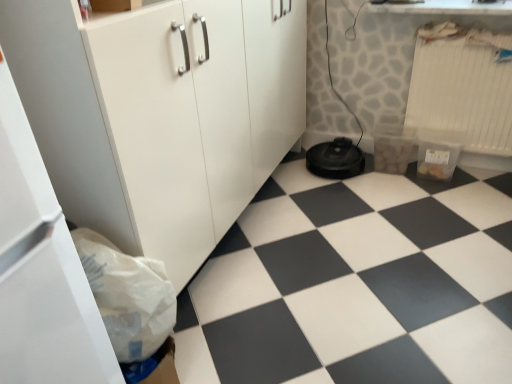
Question: Is white matte cabinet at lower left taller than white plastic radiator at upper right?

Choices:
 (A) no
 (B) yes

Answer: (B)

Question: From a real-world perspective, is white matte cabinet at lower left located beneath white plastic radiator at upper right?

Choices:
 (A) no
 (B) yes

Answer: (A)

Question: Can you see white matte cabinet at lower left touching white plastic radiator at upper right?

Choices:
 (A) no
 (B) yes

Answer: (A)

Question: Is white matte cabinet at lower left at the right side of white plastic radiator at upper right?

Choices:
 (A) no
 (B) yes

Answer: (A)

Question: Does white matte cabinet at lower left have a lesser width compared to white plastic radiator at upper right?

Choices:
 (A) yes
 (B) no

Answer: (B)

Question: From the image's perspective, relative to white plastic radiator at upper right, is white matte cabinet at lower left above or below?

Choices:
 (A) above
 (B) below

Answer: (B)

Question: Is point (125, 119) closer or farther from the camera than point (487, 99)?

Choices:
 (A) closer
 (B) farther

Answer: (A)

Question: In terms of size, does white matte cabinet at lower left appear bigger or smaller than white plastic radiator at upper right?

Choices:
 (A) small
 (B) big

Answer: (B)

Question: From a real-world perspective, is white matte cabinet at lower left positioned above or below white plastic radiator at upper right?

Choices:
 (A) above
 (B) below

Answer: (A)

Question: Looking at their shapes, would you say black plastic robot vacuum cleaner at lower center is wider or thinner than black rubber vacuum cleaner at lower center?

Choices:
 (A) thin
 (B) wide

Answer: (A)

Question: From the image's perspective, is black plastic robot vacuum cleaner at lower center above or below black rubber vacuum cleaner at lower center?

Choices:
 (A) below
 (B) above

Answer: (B)

Question: From their relative heights in the image, would you say black plastic robot vacuum cleaner at lower center is taller or shorter than black rubber vacuum cleaner at lower center?

Choices:
 (A) tall
 (B) short

Answer: (A)

Question: In the image, is black plastic robot vacuum cleaner at lower center positioned in front of or behind black rubber vacuum cleaner at lower center?

Choices:
 (A) front
 (B) behind

Answer: (B)

Question: From a real-world perspective, is white paper bag at lower left positioned above or below white plastic radiator at upper right?

Choices:
 (A) below
 (B) above

Answer: (B)

Question: Does point (108, 284) appear closer or farther from the camera than point (483, 62)?

Choices:
 (A) closer
 (B) farther

Answer: (A)